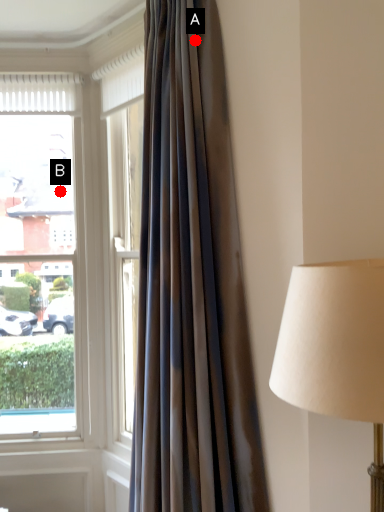
Question: Two points are circled on the image, labeled by A and B beside each circle. Which point is closer to the camera?

Choices:
 (A) A is closer
 (B) B is closer

Answer: (A)